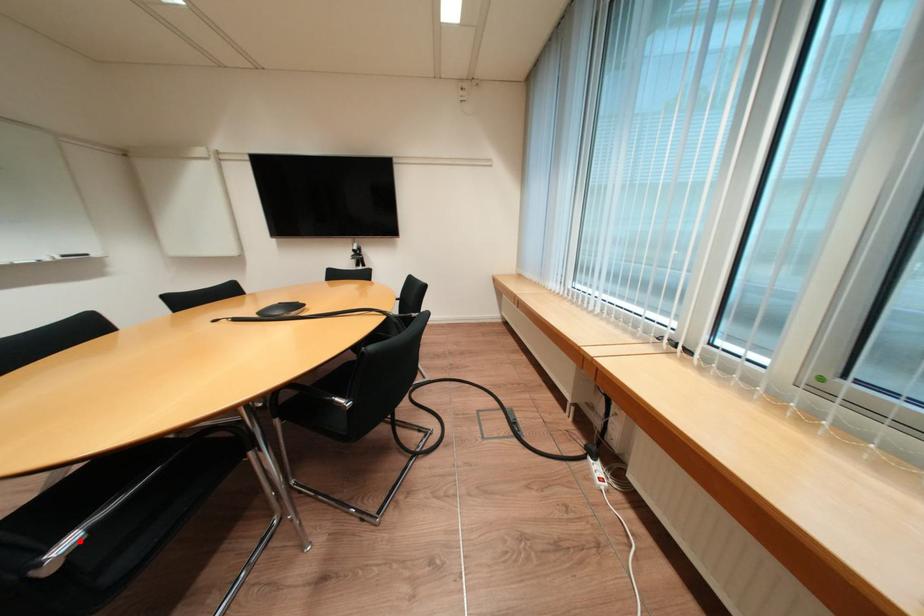
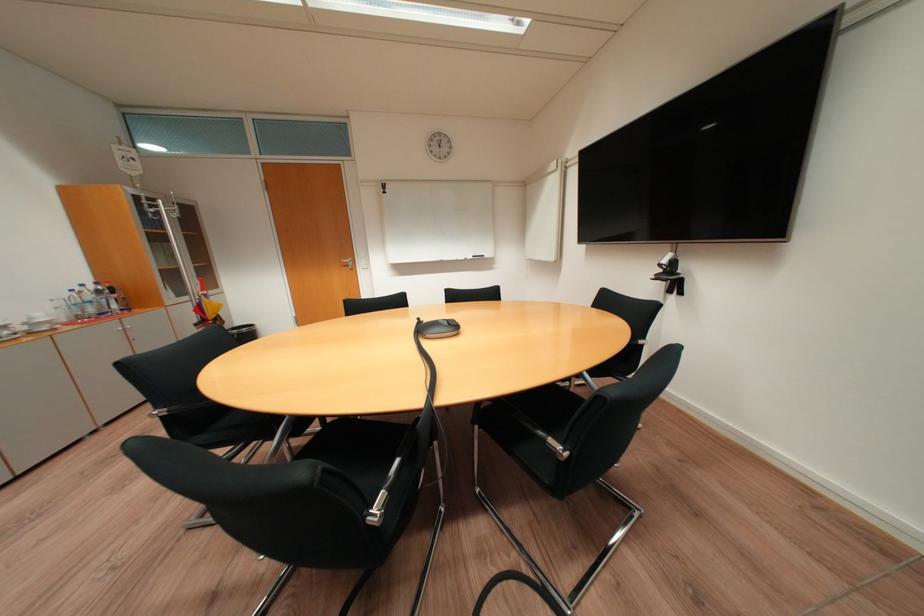
Question: I am providing you with two images of the same scene from different viewpoints. Image1 has a red point marked. In image2, the corresponding 3D location appears at what relative position? Reply with the corresponding letter.

Choices:
 (A) Closer
 (B) Farther

Answer: (B)